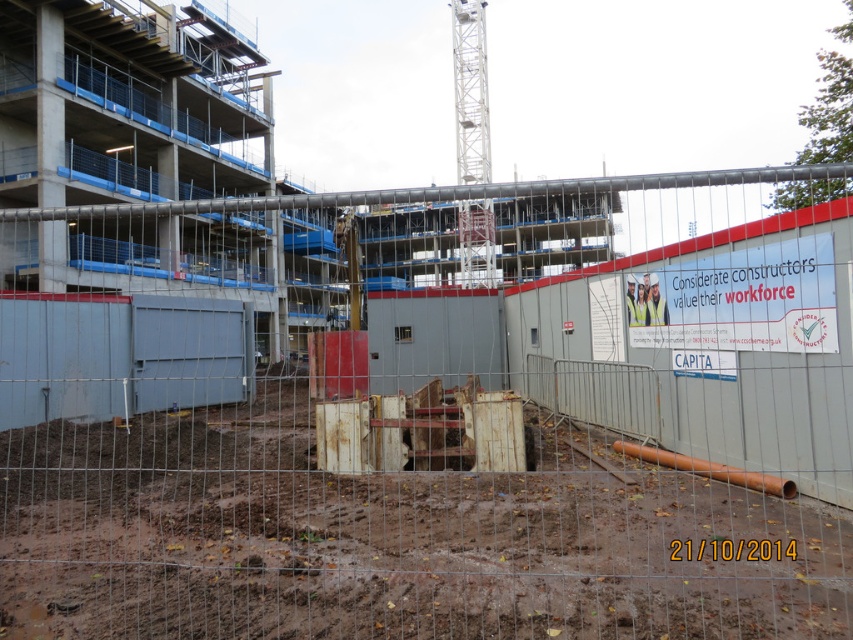
Which is more to the right, brown muddy dirt at center or white paper at center?

From the viewer's perspective, white paper at center appears more on the right side.

Where is `brown muddy dirt at center`? The image size is (853, 640). brown muddy dirt at center is located at coordinates (389, 531).

Where is `brown muddy dirt at center`? This screenshot has height=640, width=853. brown muddy dirt at center is located at coordinates (389, 531).